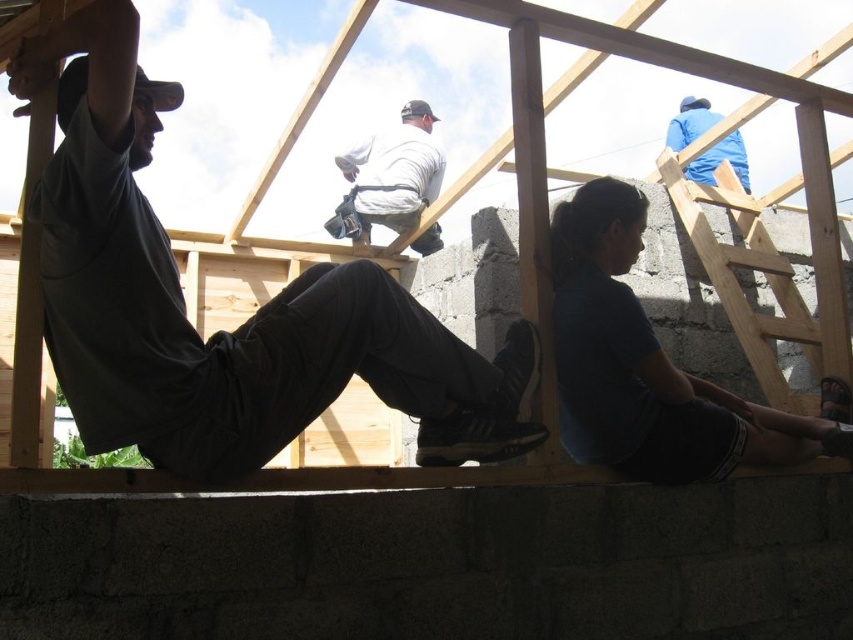
You are a construction worker who needs to cover a large equipment with a tarp. You have two blue fabrics available in the scene. Which one between the blue fabric at lower right and the blue fabric jacket at upper right would be more suitable for covering the equipment?

The blue fabric at lower right has a larger size compared to the blue fabric jacket at upper right, so it would be more suitable for covering the large equipment.

You are an observer standing at the center of the construction site. You notice two blue fabrics in the scene. The first is the blue fabric at lower right, and the second is the blue fabric jacket at upper right. Which of these two blue fabrics is wider?

The blue fabric at lower right is wider than the blue fabric jacket at upper right.

You are a safety inspector at the construction site. You need to ensure that the dark gray shirt at upper left and the blue fabric at lower right are visible from your current position. Which object is easier to see from your current vantage point?

The dark gray shirt at upper left is larger in size than the blue fabric at lower right, so it is easier to see from your current vantage point.